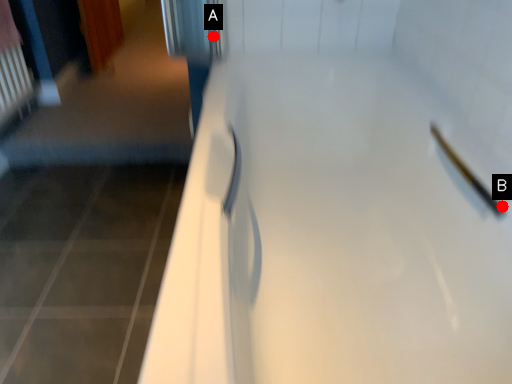
Question: Two points are circled on the image, labeled by A and B beside each circle. Among these points, which one is farthest from the camera?

Choices:
 (A) A is further
 (B) B is further

Answer: (A)